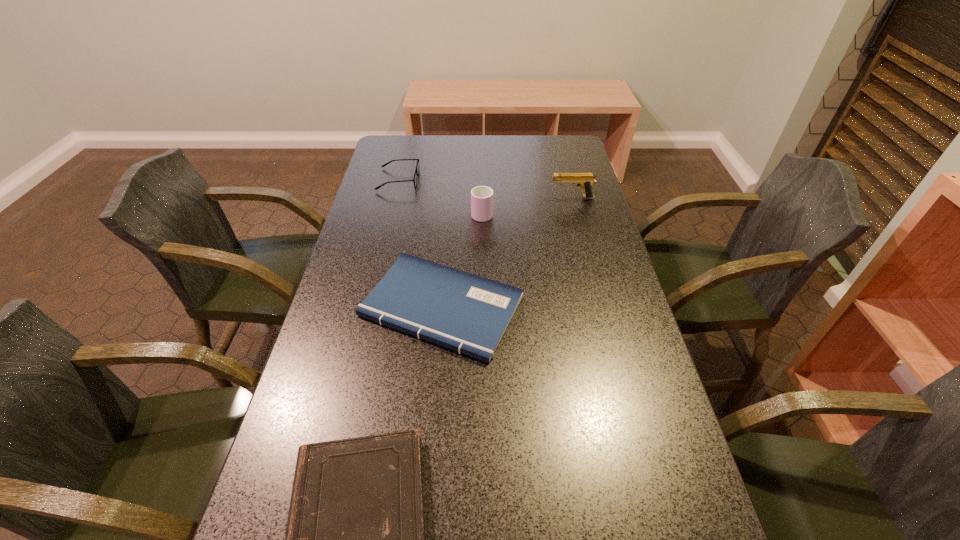
In the image, there is a desktop. In order to click on vacant space at the far left corner in this screenshot , I will do `click(391, 155)`.

Where is `free spot between the third nearest object and the pistol`? The width and height of the screenshot is (960, 540). free spot between the third nearest object and the pistol is located at coordinates (527, 205).

Find the location of a particular element. This screenshot has height=540, width=960. unoccupied area between the spectacles and the third nearest object is located at coordinates (440, 196).

Where is `vacant point located between the farthest object and the cup`? vacant point located between the farthest object and the cup is located at coordinates (440, 196).

Where is `object that stands as the third closest to the nearest object`? Image resolution: width=960 pixels, height=540 pixels. object that stands as the third closest to the nearest object is located at coordinates (416, 173).

Identify which object is located as the nearest to the third farthest object. Please provide its 2D coordinates. Your answer should be formatted as a tuple, i.e. [(x, y)], where the tuple contains the x and y coordinates of a point satisfying the conditions above.

[(461, 311)]

Find the location of a particular element. vacant space that satisfies the following two spatial constraints: 1. on the front-facing side of the spectacles; 2. with the handle on the side of the cup is located at coordinates (390, 213).

Find the location of `free space that satisfies the following two spatial constraints: 1. on the front-facing side of the farthest object; 2. on the right side of the fourth farthest object`. free space that satisfies the following two spatial constraints: 1. on the front-facing side of the farthest object; 2. on the right side of the fourth farthest object is located at coordinates (367, 307).

The width and height of the screenshot is (960, 540). Find the location of `vacant area that satisfies the following two spatial constraints: 1. on the front-facing side of the third shortest object; 2. on the left side of the farther paperback book`. vacant area that satisfies the following two spatial constraints: 1. on the front-facing side of the third shortest object; 2. on the left side of the farther paperback book is located at coordinates (367, 307).

The image size is (960, 540). I want to click on blank space that satisfies the following two spatial constraints: 1. on the front-facing side of the spectacles; 2. with the handle on the side of the third farthest object, so click(390, 213).